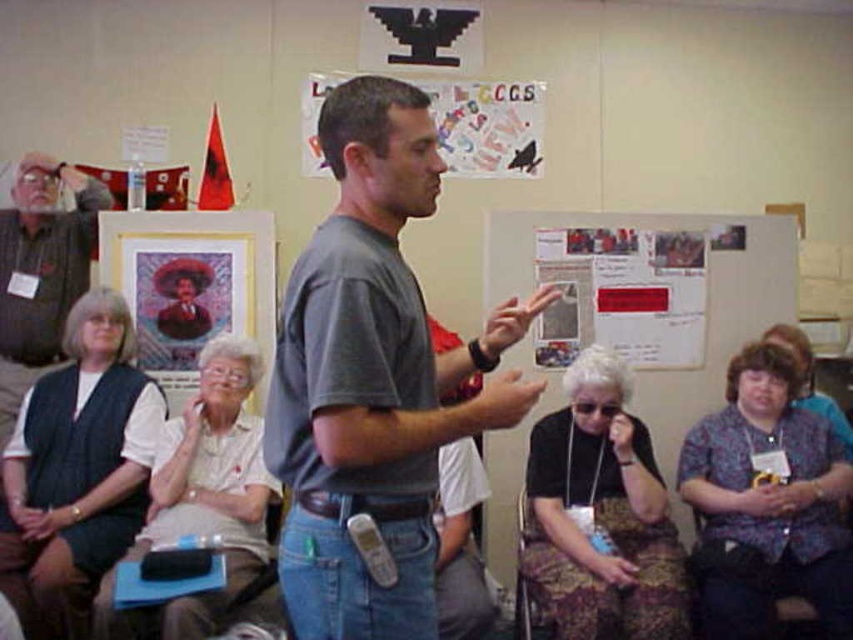
Question: Estimate the real-world distances between objects in this image. Which object is closer to the white paper poster at center?

Choices:
 (A) black fabric purse at lower right
 (B) gray matte t-shirt at center
 (C) printed paper poster at center
 (D) dark blue textured vest at left

Answer: (C)

Question: Does dark blue textured vest at left appear over black fabric purse at lower right?

Choices:
 (A) no
 (B) yes

Answer: (B)

Question: Where is printed paper poster at center located in relation to gray flannel shirt at left in the image?

Choices:
 (A) above
 (B) below

Answer: (A)

Question: Where is gray matte t-shirt at center located in relation to white fabric shirt at center in the image?

Choices:
 (A) below
 (B) above

Answer: (B)

Question: Which of the following is the farthest from the observer?

Choices:
 (A) (392, 484)
 (B) (252, 499)
 (C) (62, 262)
 (D) (529, 115)

Answer: (D)

Question: Among these points, which one is farthest from the camera?

Choices:
 (A) (21, 168)
 (B) (556, 621)

Answer: (A)